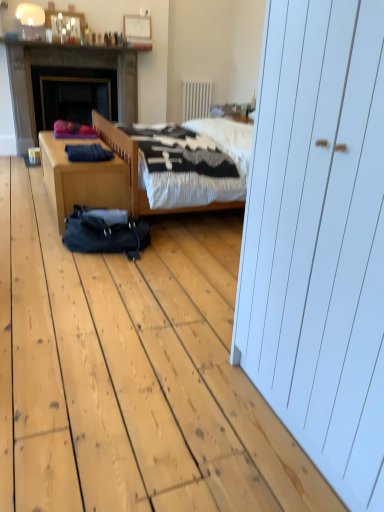
At what (x,y) coordinates should I click in order to perform the action: click on black fabric sleeping bag at center. Please return your answer as a coordinate pair (x, y). The width and height of the screenshot is (384, 512). Looking at the image, I should click on (105, 232).

Measure the distance between point (x=193, y=112) and camera.

They are 18.29 feet apart.

Describe the element at coordinates (196, 99) in the screenshot. I see `white textured radiator at upper center` at that location.

The width and height of the screenshot is (384, 512). What do you see at coordinates (82, 179) in the screenshot? I see `wooden desk at lower left` at bounding box center [82, 179].

Measure the distance between point (x=115, y=54) and camera.

4.80 meters.

In order to click on dark gray stone fireplace at left in this screenshot , I will do `click(65, 66)`.

Identify the location of shiny glass bottles at upper center. tap(72, 45).

You are a GUI agent. You are given a task and a screenshot of the screen. Output one action in this format:
    pyautogui.click(x=<x>, y=<y>)
    Task: Click on the radiator below the shiny glass bottles at upper center (from the image's perspective)
    This screenshot has width=384, height=512.
    Given the screenshot: What is the action you would take?
    pyautogui.click(x=196, y=99)

Which of these two, white textured radiator at upper center or shiny glass bottles at upper center, stands taller?

Standing taller between the two is white textured radiator at upper center.

In the scene shown: Is white textured radiator at upper center at the left side of shiny glass bottles at upper center?

No, white textured radiator at upper center is not to the left of shiny glass bottles at upper center.

Are white textured radiator at upper center and shiny glass bottles at upper center beside each other?

No, white textured radiator at upper center is not touching shiny glass bottles at upper center.

Are matte white lampshade at upper left and black fabric sleeping bag at center located far from each other?

Yes, matte white lampshade at upper left is far from black fabric sleeping bag at center.

From the image's perspective, is matte white lampshade at upper left beneath black fabric sleeping bag at center?

No.

Can you confirm if matte white lampshade at upper left is taller than black fabric sleeping bag at center?

Correct, matte white lampshade at upper left is much taller as black fabric sleeping bag at center.

Based on the photo, how many degrees apart are the facing directions of matte white lampshade at upper left and black fabric sleeping bag at center?

The facing directions of matte white lampshade at upper left and black fabric sleeping bag at center are 93.4 degrees apart.

Is wooden desk at lower left looking in the opposite direction of white textured radiator at upper center?

wooden desk at lower left is not turned away from white textured radiator at upper center.

Consider the image. From their relative heights in the image, would you say wooden desk at lower left is taller or shorter than white textured radiator at upper center?

Considering their sizes, wooden desk at lower left has less height than white textured radiator at upper center.

In the scene shown: Does wooden desk at lower left have a larger size compared to white textured radiator at upper center?

Yes.

Considering the positions of objects wooden desk at lower left and white textured radiator at upper center in the image provided, who is more to the right, wooden desk at lower left or white textured radiator at upper center?

white textured radiator at upper center.

From a real-world perspective, is wooden desk at lower left below dark gray stone fireplace at left?

Indeed, from a real-world perspective, wooden desk at lower left is positioned beneath dark gray stone fireplace at left.

Does wooden desk at lower left turn towards dark gray stone fireplace at left?

No, wooden desk at lower left is not facing towards dark gray stone fireplace at left.

Can you confirm if wooden desk at lower left is positioned to the left of dark gray stone fireplace at left?

No.

Which is in front, wooden desk at lower left or dark gray stone fireplace at left?

wooden desk at lower left is closer to the camera.

I want to click on mantle above the white textured radiator at upper center (from the image's perspective), so click(x=72, y=45).

Between shiny glass bottles at upper center and white textured radiator at upper center, which one has smaller size?

white textured radiator at upper center is smaller.

Considering the relative positions of shiny glass bottles at upper center and white textured radiator at upper center in the image provided, is shiny glass bottles at upper center to the left of white textured radiator at upper center from the viewer's perspective?

Yes.

Does wooden desk at lower left have a lesser width compared to black fabric sleeping bag at center?

Correct, the width of wooden desk at lower left is less than that of black fabric sleeping bag at center.

Measure the distance from wooden desk at lower left to black fabric sleeping bag at center.

wooden desk at lower left and black fabric sleeping bag at center are 36.15 centimeters apart.

From a real-world perspective, is wooden desk at lower left above or below black fabric sleeping bag at center?

wooden desk at lower left is situated higher than black fabric sleeping bag at center in the real world.

The width and height of the screenshot is (384, 512). There is a black fabric sleeping bag at center. Find the location of `desk above it (from a real-world perspective)`. desk above it (from a real-world perspective) is located at coordinates (82, 179).

In the scene shown: Which of these two, matte white lampshade at upper left or white textured radiator at upper center, stands shorter?

matte white lampshade at upper left.

Is matte white lampshade at upper left next to white textured radiator at upper center?

No, matte white lampshade at upper left is not touching white textured radiator at upper center.

From a real-world perspective, is matte white lampshade at upper left physically above white textured radiator at upper center?

Correct, in the physical world, matte white lampshade at upper left is higher than white textured radiator at upper center.

Identify the location of radiator that appears on the right of matte white lampshade at upper left. The height and width of the screenshot is (512, 384). (196, 99).

Where is `mantle that is on the left side of white textured radiator at upper center`? mantle that is on the left side of white textured radiator at upper center is located at coordinates (72, 45).

Identify the location of sleeping bag that is below the matte white lampshade at upper left (from the image's perspective). This screenshot has width=384, height=512. (105, 232).

Estimate the real-world distances between objects in this image. Which object is closer to white textured radiator at upper center, black fabric sleeping bag at center or wooden desk at lower left?

Answer: wooden desk at lower left is closer to white textured radiator at upper center.

Estimate the real-world distances between objects in this image. Which object is further from wooden desk at lower left, white textured radiator at upper center or black fabric sleeping bag at center?

white textured radiator at upper center lies further to wooden desk at lower left than the other object.

Based on their spatial positions, is shiny glass bottles at upper center or black fabric sleeping bag at center further from white textured radiator at upper center?

black fabric sleeping bag at center.

When comparing their distances from dark gray stone fireplace at left, does wooden desk at lower left or white textured radiator at upper center seem closer?

white textured radiator at upper center lies closer to dark gray stone fireplace at left than the other object.

Estimate the real-world distances between objects in this image. Which object is closer to dark gray stone fireplace at left, matte white lampshade at upper left or white textured radiator at upper center?

Based on the image, matte white lampshade at upper left appears to be nearer to dark gray stone fireplace at left.

Which object lies further to the anchor point wooden desk at lower left, white textured radiator at upper center or dark gray stone fireplace at left?

white textured radiator at upper center.

From the image, which object appears to be farther from shiny glass bottles at upper center, black fabric sleeping bag at center or white textured radiator at upper center?

The object further to shiny glass bottles at upper center is black fabric sleeping bag at center.

Considering their positions, is wooden desk at lower left positioned closer to white textured radiator at upper center than dark gray stone fireplace at left?

dark gray stone fireplace at left.

Find the location of a particular element. The width and height of the screenshot is (384, 512). fireplace located between black fabric sleeping bag at center and white textured radiator at upper center in the depth direction is located at coordinates (65, 66).

The width and height of the screenshot is (384, 512). I want to click on desk between black fabric sleeping bag at center and white textured radiator at upper center in the front-back direction, so click(82, 179).

At what (x,y) coordinates should I click in order to perform the action: click on mantle situated between dark gray stone fireplace at left and white textured radiator at upper center from left to right. Please return your answer as a coordinate pair (x, y). The width and height of the screenshot is (384, 512). Looking at the image, I should click on pos(72,45).

This screenshot has width=384, height=512. In order to click on mantle between matte white lampshade at upper left and white textured radiator at upper center in this screenshot , I will do `click(72, 45)`.